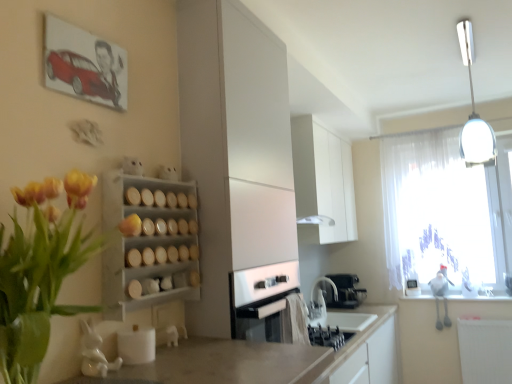
What are the coordinates of `blank space situated above white glossy light fixture at upper right (from a real-world perspective)` in the screenshot? It's located at (472, 36).